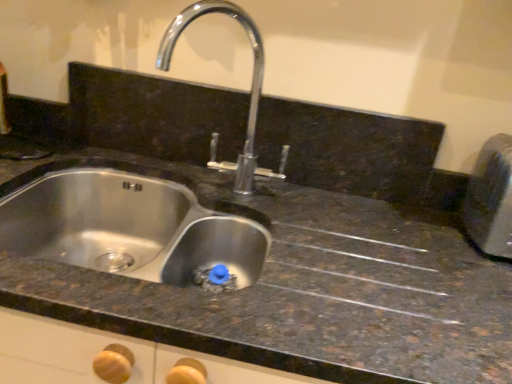
Question: Is polished chrome tap at center inside the boundaries of metallic silver toaster at right, or outside?

Choices:
 (A) outside
 (B) inside

Answer: (A)

Question: Relative to metallic silver toaster at right, is polished chrome tap at center in front or behind?

Choices:
 (A) front
 (B) behind

Answer: (A)

Question: Considering the real-world distances, which object is closest to the metallic silver toaster at right?

Choices:
 (A) polished chrome tap at center
 (B) stainless steel sink at center

Answer: (A)

Question: Which object is positioned closest to the metallic silver toaster at right?

Choices:
 (A) polished chrome tap at center
 (B) stainless steel sink at center

Answer: (A)